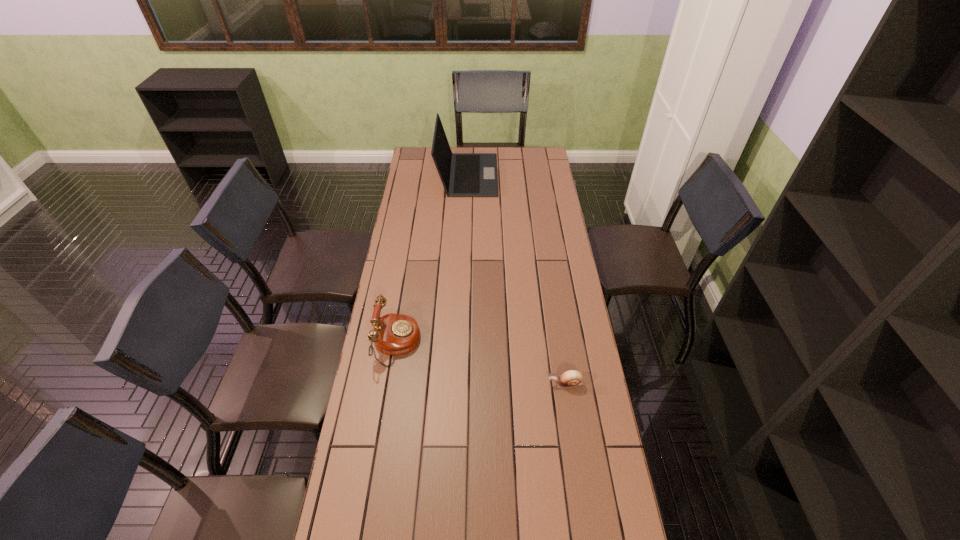
Locate an element on the screen. unoccupied area between the nearest object and the laptop is located at coordinates (516, 279).

Find the location of a particular element. This screenshot has width=960, height=540. free space between the second farthest object and the farthest object is located at coordinates (432, 259).

The image size is (960, 540). Identify the location of free space between the telephone and the laptop. (432, 259).

Locate an element on the screen. unoccupied area between the shortest object and the laptop is located at coordinates (516, 279).

Point out which object is positioned as the nearest to the farthest object. Please provide its 2D coordinates. Your answer should be formatted as a tuple, i.e. [(x, y)], where the tuple contains the x and y coordinates of a point satisfying the conditions above.

[(394, 334)]

Locate an element on the screen. This screenshot has width=960, height=540. object that ranks as the second closest to the telephone is located at coordinates (462, 174).